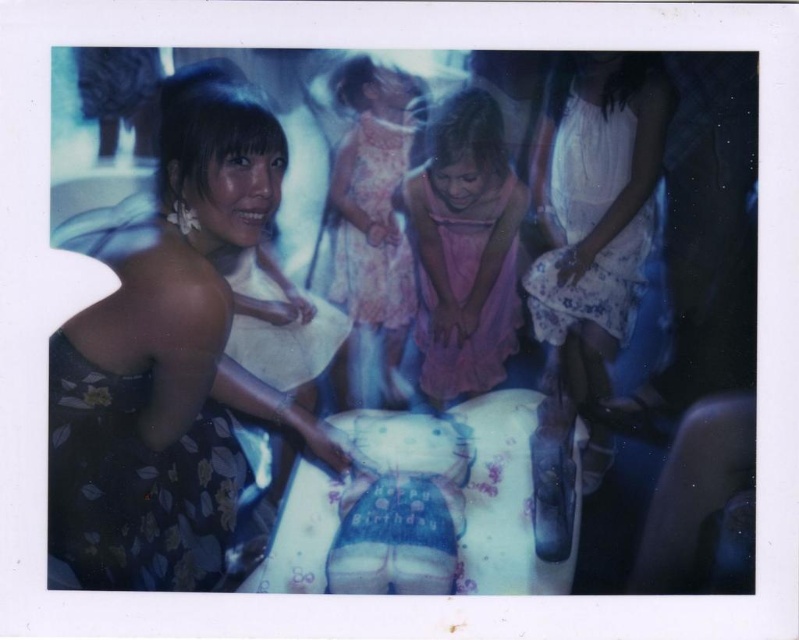
You are at a birthday party and see two guests wearing floral dresses. One is wearing a floral dress at left and the other a pink floral dress at center. Which guest is standing closer to the cake?

The floral dress at left is taller than the pink floral dress at center. Since taller objects appear closer in photos, the guest wearing the floral dress at left is likely standing closer to the cake.

You are a photographer trying to capture a group photo of the people at the birthday party. The pink satin dress at center and the pink floral dress at center are both in the frame. If your camera has a minimum focus distance of 10 centimeters, will you be able to focus on both dresses simultaneously?

The distance between the pink satin dress at center and the pink floral dress at center is 8.89 centimeters, which is less than the camera minimum focus distance of 10 centimeters. Therefore, the camera can focus on both dresses simultaneously.

You are a photographer at the birthday party and need to adjust the camera focus. Which dress should you focus on first if the floral dress at left is closer to the camera than the pink satin dress at center?

The floral dress at left should be focused on first because it is closer to the camera than the pink satin dress at center.